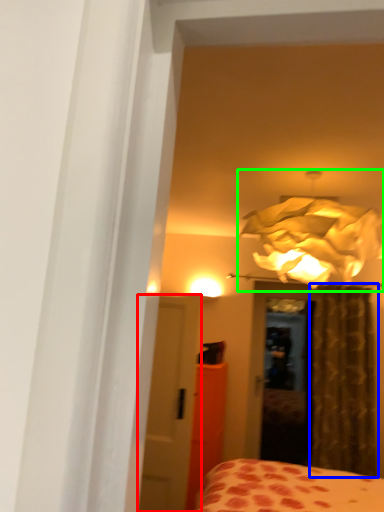
Question: Which object is the closest to the door (highlighted by a red box)? Choose among these: curtain (highlighted by a blue box) or lamp (highlighted by a green box).

Choices:
 (A) curtain
 (B) lamp

Answer: (B)